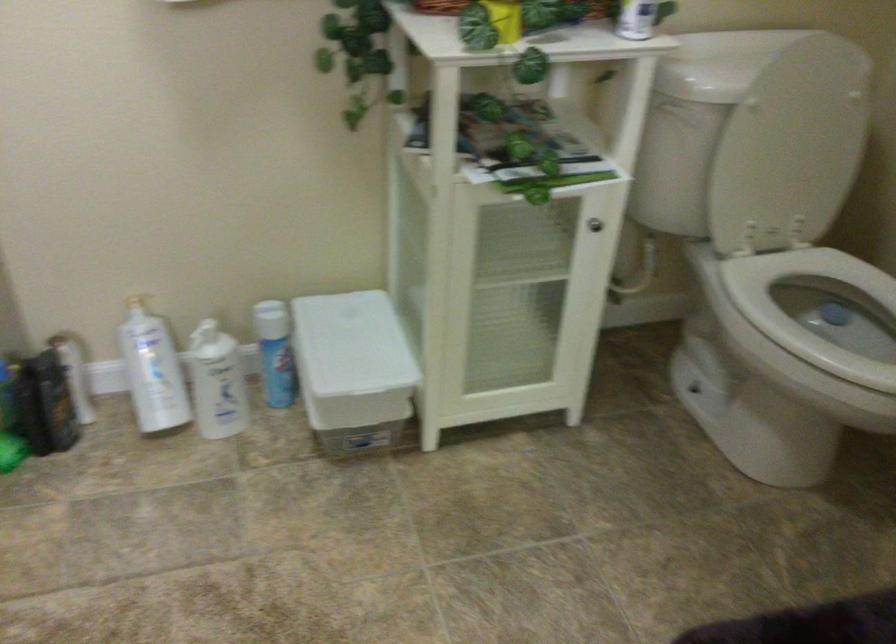
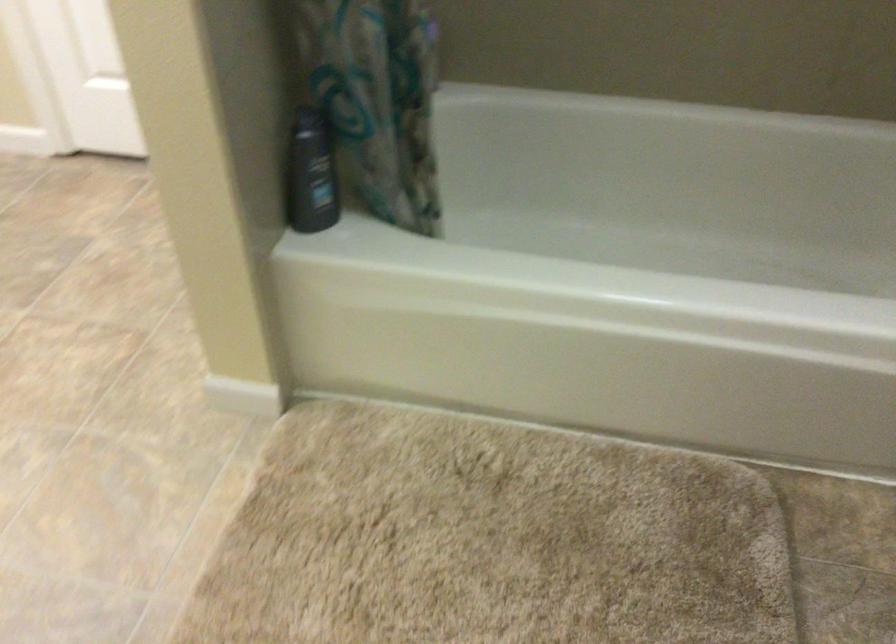
First-person continuous shooting, in which direction is the camera rotating?

The rotation direction of the camera is left-down.